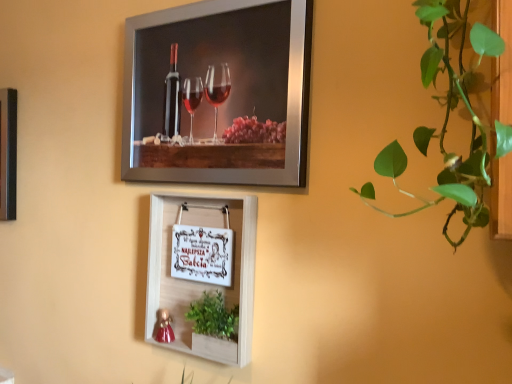
Question: Based on their sizes in the image, would you say metallic silver picture frame at upper center, marked as the first picture frame in a top-to-bottom arrangement, is bigger or smaller than green leafy plant at lower center?

Choices:
 (A) small
 (B) big

Answer: (B)

Question: Looking at their shapes, would you say metallic silver picture frame at upper center, positioned as the second picture frame in bottom-to-top order, is wider or thinner than green leafy plant at lower center?

Choices:
 (A) thin
 (B) wide

Answer: (A)

Question: Based on their relative distances, which object is nearer to the metallic silver picture frame at upper center, marked as the first picture frame in a top-to-bottom arrangement?

Choices:
 (A) green leafy plant at right
 (B) green leafy plant at lower center
 (C) white wood picture frame at center, the 2th picture frame positioned from the top

Answer: (C)

Question: Estimate the real-world distances between objects in this image. Which object is farther from the green leafy plant at right?

Choices:
 (A) white wood picture frame at center, acting as the 1th picture frame starting from the bottom
 (B) metallic silver picture frame at upper center, positioned as the second picture frame in bottom-to-top order
 (C) green leafy plant at lower center

Answer: (C)